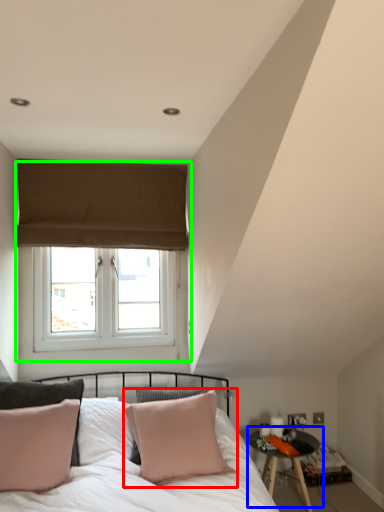
Question: Considering the real-world distances, which object is farthest from pillow (highlighted by a red box)? table (highlighted by a blue box) or window (highlighted by a green box)?

Choices:
 (A) table
 (B) window

Answer: (B)